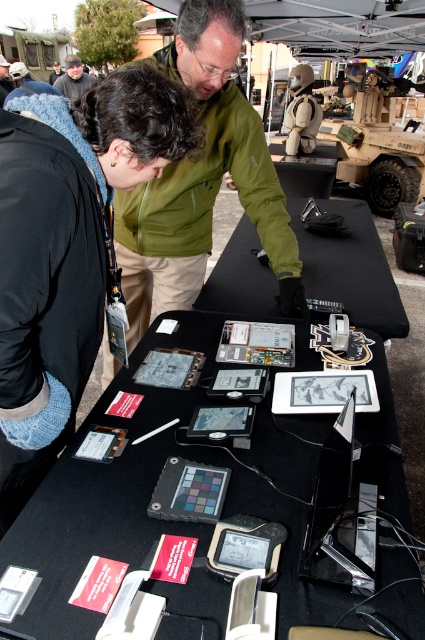
Does black fleece jacket at upper left have a greater height compared to jeans at lower left?

No, black fleece jacket at upper left is not taller than jeans at lower left.

Is black fleece jacket at upper left shorter than jeans at lower left?

Yes.

Between point (119, 188) and point (28, 93), which one is positioned behind?

The point (119, 188) is more distant.

Locate an element on the screen. black fleece jacket at upper left is located at coordinates (67, 248).

Which is more to the right, black fabric at center or dark gray jacket at upper left?

From the viewer's perspective, black fabric at center appears more on the right side.

Does point (325, 289) come behind point (74, 88)?

No, it is not.

Is point (320, 198) closer to camera compared to point (85, 84)?

Yes.

What are the coordinates of `black fabric at center` in the screenshot? It's located at (351, 268).

Is point (19, 336) positioned behind point (229, 156)?

That is False.

Image resolution: width=425 pixels, height=640 pixels. Describe the element at coordinates (67, 248) in the screenshot. I see `black fleece jacket at upper left` at that location.

Does point (37, 198) come farther from viewer compared to point (204, 246)?

No, it is in front of (204, 246).

Find the location of a particular element. This screenshot has height=640, width=425. black fleece jacket at upper left is located at coordinates (67, 248).